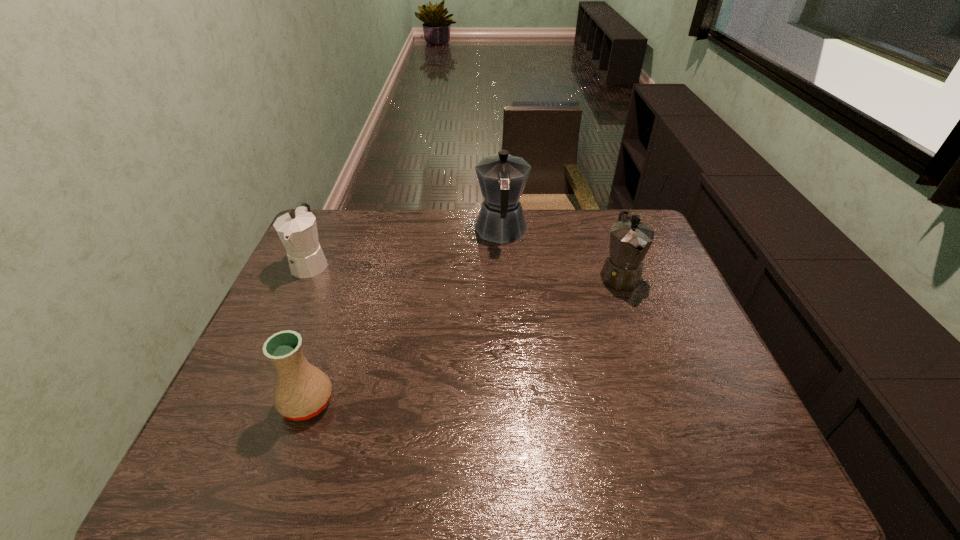
Locate an element on the screen. pottery that is at the left edge is located at coordinates (302, 391).

Find the location of `object situated at the right edge`. object situated at the right edge is located at coordinates (630, 239).

The width and height of the screenshot is (960, 540). I want to click on object that is at the far left corner, so click(x=297, y=229).

This screenshot has height=540, width=960. I want to click on vacant space at the far edge of the desktop, so click(458, 249).

I want to click on vacant space at the near edge of the desktop, so click(555, 461).

Find the location of a particular element. This screenshot has width=960, height=540. free space at the right edge of the desktop is located at coordinates (651, 250).

The image size is (960, 540). I want to click on blank space at the far left corner, so click(324, 224).

Locate an element on the screen. Image resolution: width=960 pixels, height=540 pixels. vacant area at the near left corner is located at coordinates (214, 468).

Locate an element on the screen. Image resolution: width=960 pixels, height=540 pixels. free space between the second coffeepot from right to left and the pottery is located at coordinates (404, 316).

The width and height of the screenshot is (960, 540). I want to click on free point between the leftmost coffeepot and the third object from right to left, so click(309, 333).